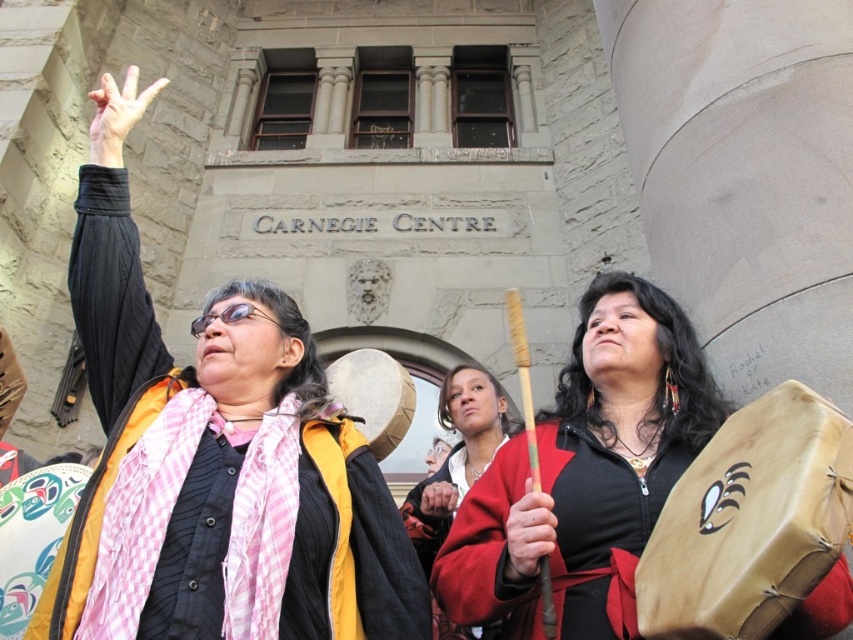
Is the position of matte brown drum at center more distant than that of matte red coat at center?

No, matte brown drum at center is closer to the viewer.

Who is taller, matte brown drum at center or matte red coat at center?

matte brown drum at center is taller.

What do you see at coordinates (585, 474) in the screenshot?
I see `matte brown drum at center` at bounding box center [585, 474].

Where is `matte brown drum at center`? This screenshot has height=640, width=853. matte brown drum at center is located at coordinates (585, 474).

Who is taller, leather drum at center or matte red coat at center?

matte red coat at center

Does leather drum at center have a greater height compared to matte red coat at center?

No, leather drum at center is not taller than matte red coat at center.

Does point (672, 572) come farther from viewer compared to point (500, 444)?

No, (672, 572) is closer to viewer.

This screenshot has height=640, width=853. Identify the location of leather drum at center. (749, 522).

Is matte red coat at center closer to camera compared to light skin tone flesh at upper left?

Yes, it is in front of light skin tone flesh at upper left.

In the scene shown: Which is above, matte red coat at center or light skin tone flesh at upper left?

Positioned higher is light skin tone flesh at upper left.

Does point (476, 397) come behind point (122, 120)?

Yes, point (476, 397) is behind point (122, 120).

Locate an element on the screen. matte red coat at center is located at coordinates (457, 449).